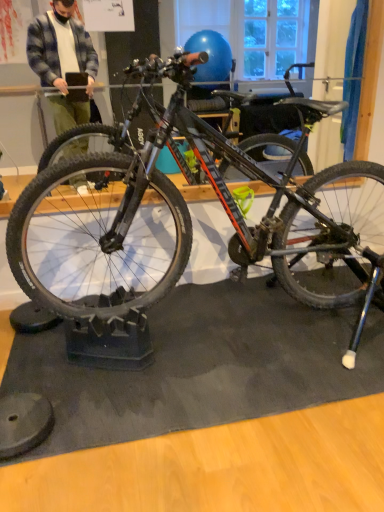
In order to face shiny metallic bicycle at center, should I rotate leftwards or rightwards?

A 5.739 degree turn to the right will do.

What do you see at coordinates (175, 229) in the screenshot?
I see `shiny metallic bicycle at center` at bounding box center [175, 229].

This screenshot has width=384, height=512. Find the location of `shiny metallic bicycle at center`. shiny metallic bicycle at center is located at coordinates (175, 229).

Where is `shiny metallic bicycle at center`? shiny metallic bicycle at center is located at coordinates (175, 229).